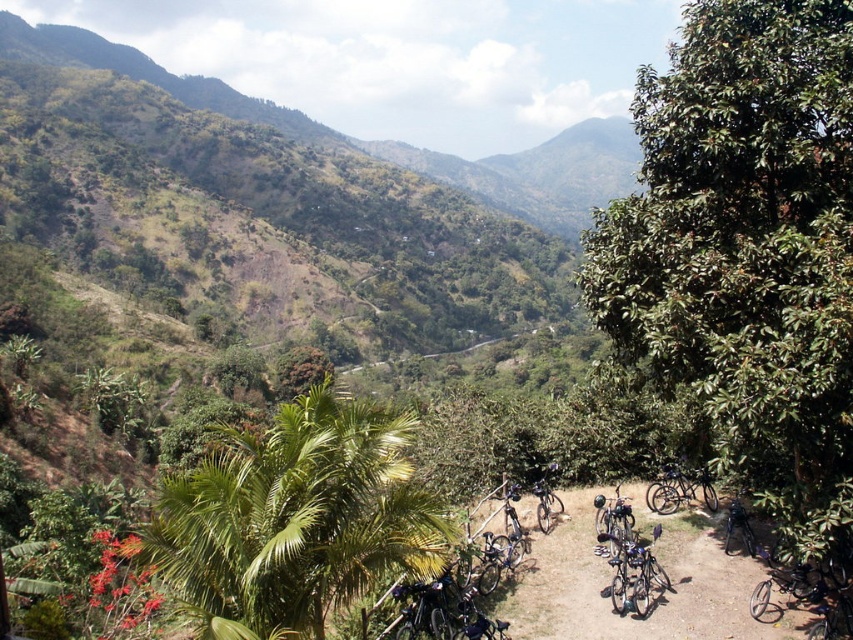
You are standing at the point labeled as point (294, 518) in the image. What object are you facing?

You are facing the green leafy palm at center, as point (294, 518) corresponds to it.